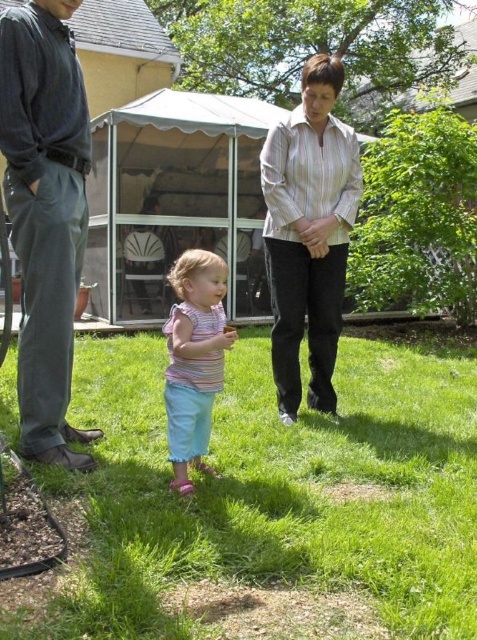
Consider the image. You are a fashion designer observing the scene. You need to determine the spatial relationship between the dark gray pants at left and the striped fabric shirt at center. Which object is covering the other?

The dark gray pants at left is positioned over striped fabric shirt at center, meaning the dark gray pants at left is covering the striped fabric shirt at center.

You are planning to buy a new pair of pants and a shirt. You see the dark gray pants at left and the striped fabric shirt at center in the image. Based on their sizes in the image, which item would you choose if you want the pants to be larger than the shirt?

The dark gray pants at left is bigger than striped fabric shirt at center, so choosing the dark gray pants at left and the striped fabric shirt at center would satisfy the requirement of having pants larger than the shirt.